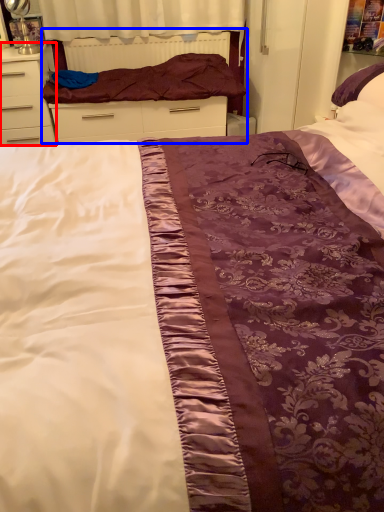
Question: Which object appears closest to the camera in this image, chest of drawers (highlighted by a red box) or bed frame (highlighted by a blue box)?

Choices:
 (A) chest of drawers
 (B) bed frame

Answer: (A)